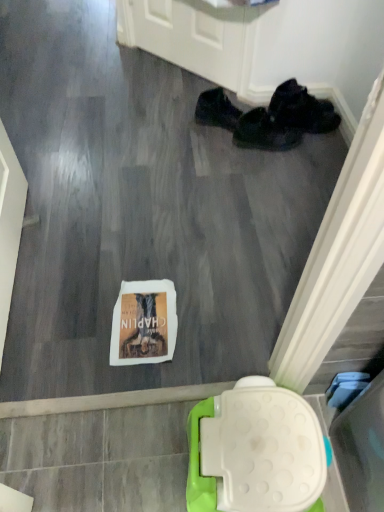
I want to click on free space in front of black fabric shoes at upper right, the 1th footwear when ordered from right to left, so click(x=304, y=148).